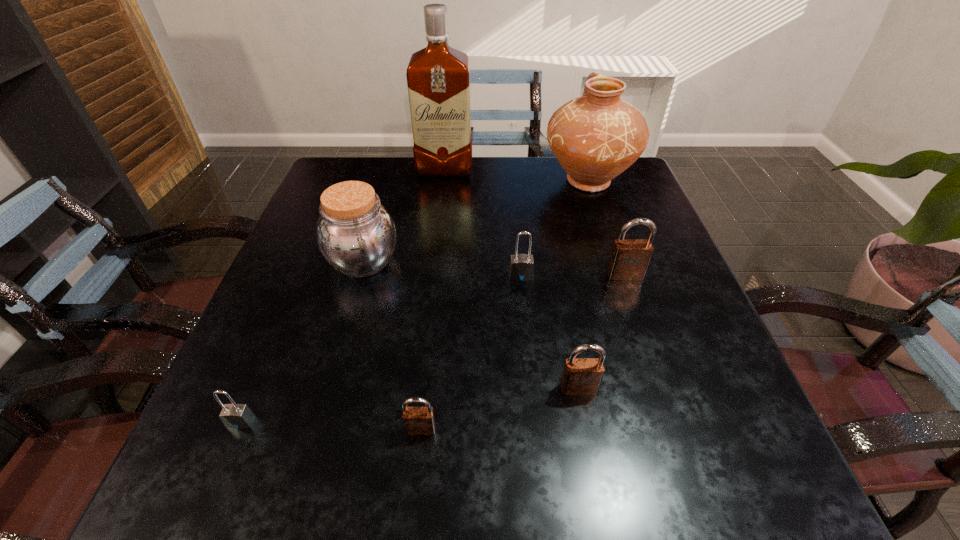
Where is `the left gray padlock`? This screenshot has width=960, height=540. the left gray padlock is located at coordinates (237, 416).

This screenshot has width=960, height=540. Identify the location of the nearest brown padlock. (417, 420).

This screenshot has height=540, width=960. I want to click on the leftmost brown padlock, so click(417, 420).

At what (x,y) coordinates should I click in order to perform the action: click on free spot located 0.240m on the front label of the tallest object. Please return your answer as a coordinate pair (x, y). The image size is (960, 540). Looking at the image, I should click on (438, 232).

Find the location of a particular element. This screenshot has width=960, height=540. free space located on the back of the jar is located at coordinates (386, 181).

Locate an element on the screen. The image size is (960, 540). free space located 0.130m on the front-facing side of the farthest brown padlock is located at coordinates (643, 328).

In order to click on vacant region located on the shackle of the right gray padlock in this screenshot , I will do `click(526, 333)`.

Identify the location of vacant region located on the front-facing side of the third nearest padlock. This screenshot has height=540, width=960. pos(596,481).

At what (x,y) coordinates should I click in order to perform the action: click on free point located 0.110m on the shackle of the leftmost object. Please return your answer as a coordinate pair (x, y). Looking at the image, I should click on (206, 503).

Where is `liquor at the far edge`? liquor at the far edge is located at coordinates (438, 77).